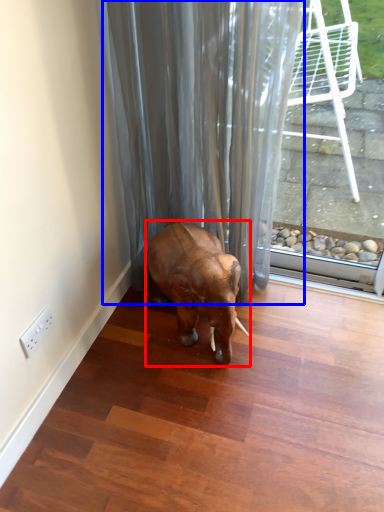
Question: Which object is further to the camera taking this photo, elephant (highlighted by a red box) or shower curtain (highlighted by a blue box)?

Choices:
 (A) elephant
 (B) shower curtain

Answer: (A)